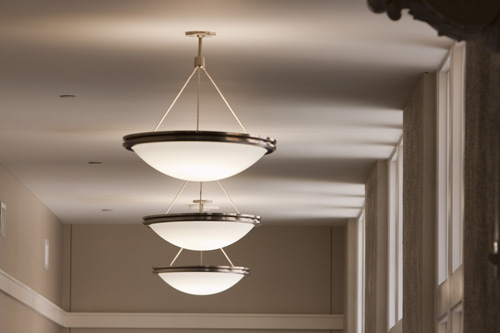
Where is `crown moulding`? This screenshot has width=500, height=333. crown moulding is located at coordinates (245, 322).